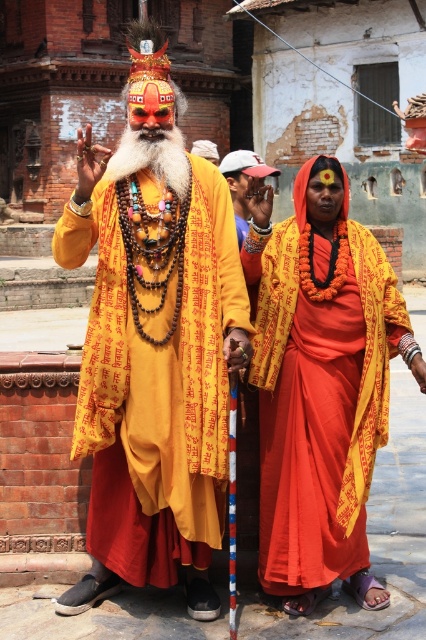
At what (x,y) coordinates should I click in order to perform the action: click on orange silk sari at center. Please return your answer as a coordinate pair (x, y). Looking at the image, I should click on (321, 385).

Can you confirm if orange silk sari at center is smaller than white fluffy beard at center?

Yes.

The image size is (426, 640). Identify the location of orange silk sari at center. [321, 385].

Find the location of a particular element. orange silk sari at center is located at coordinates (321, 385).

In the scene shown: Can you confirm if matte yellow robe at center is taller than orange silk sari at center?

Yes.

Is matte yellow robe at center to the right of orange silk sari at center from the viewer's perspective?

No, matte yellow robe at center is not to the right of orange silk sari at center.

Find the location of a particular element. matte yellow robe at center is located at coordinates (154, 342).

Who is taller, matte yellow robe at center or white fluffy beard at center?

Standing taller between the two is matte yellow robe at center.

Can you confirm if matte yellow robe at center is shorter than white fluffy beard at center?

In fact, matte yellow robe at center may be taller than white fluffy beard at center.

Image resolution: width=426 pixels, height=640 pixels. Describe the element at coordinates (154, 342) in the screenshot. I see `matte yellow robe at center` at that location.

At what (x,y) coordinates should I click in order to perform the action: click on matte yellow robe at center. Please return your answer as a coordinate pair (x, y). The width and height of the screenshot is (426, 640). Looking at the image, I should click on (154, 342).